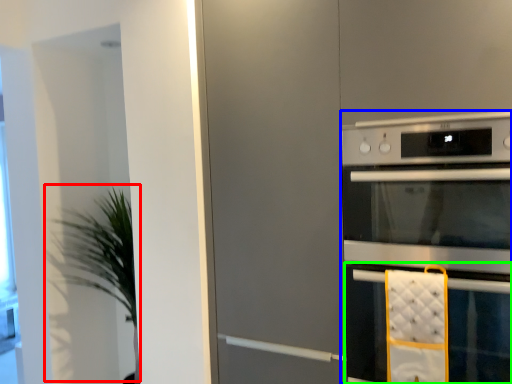
Question: Considering the real-world distances, which object is farthest from plant (highlighted by a red box)? home appliance (highlighted by a blue box) or oven (highlighted by a green box)?

Choices:
 (A) home appliance
 (B) oven

Answer: (B)